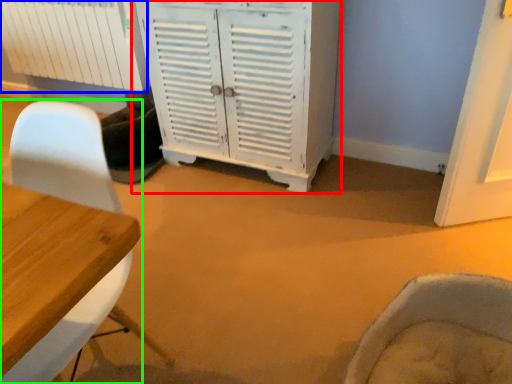
Question: Which is farther away from cabinetry (highlighted by a red box)? radiator (highlighted by a blue box) or chair (highlighted by a green box)?

Choices:
 (A) radiator
 (B) chair

Answer: (B)